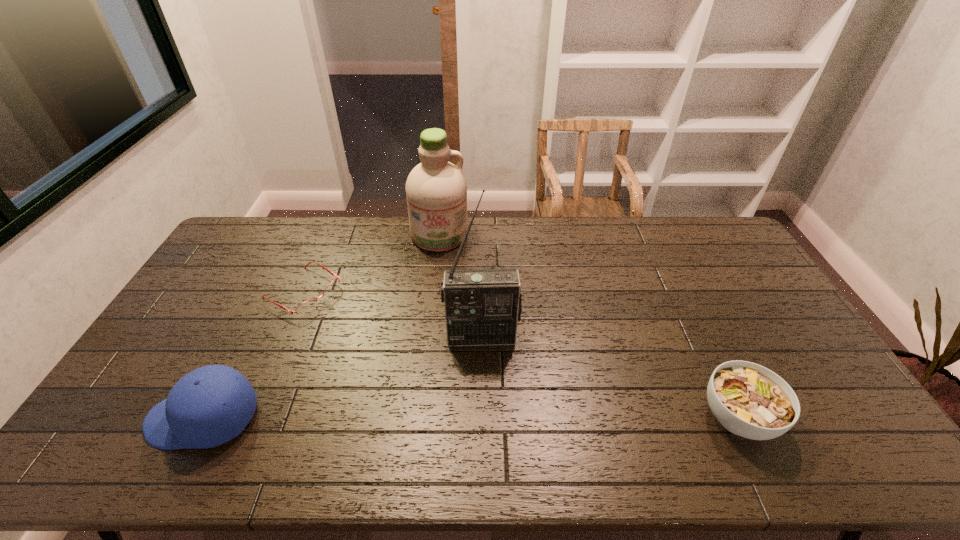
Identify the location of free area in between the spectacles and the soup bowl. (520, 355).

Identify which object is located as the nearest to the fourth tallest object. Please provide its 2D coordinates. Your answer should be formatted as a tuple, i.e. [(x, y)], where the tuple contains the x and y coordinates of a point satisfying the conditions above.

[(482, 306)]

Select which object is the fourth closest to the farthest object. Please provide its 2D coordinates. Your answer should be formatted as a tuple, i.e. [(x, y)], where the tuple contains the x and y coordinates of a point satisfying the conditions above.

[(749, 400)]